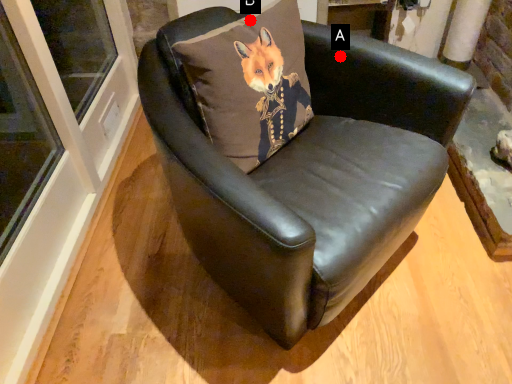
Question: Two points are circled on the image, labeled by A and B beside each circle. Which point appears closest to the camera in this image?

Choices:
 (A) A is closer
 (B) B is closer

Answer: (B)